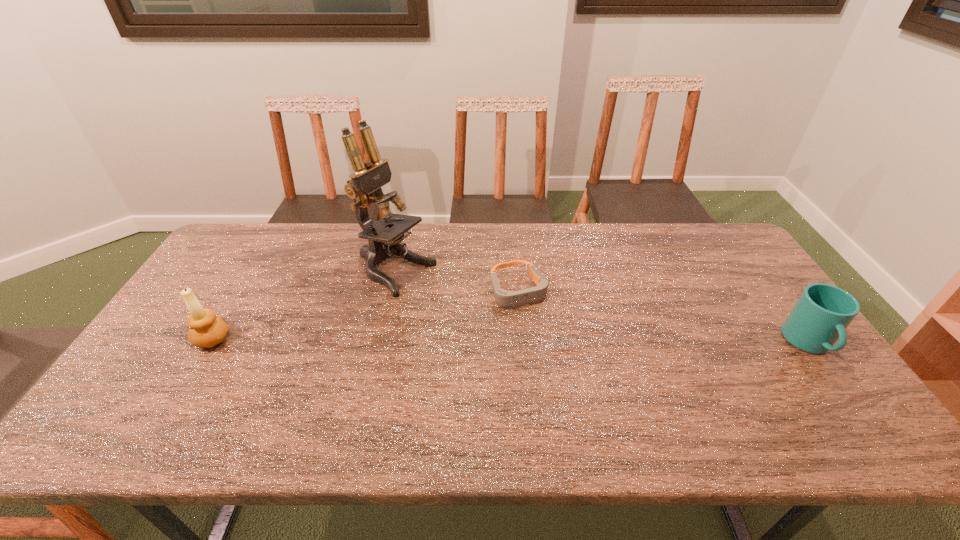
Locate an element on the screen. empty location between the microscope and the cup is located at coordinates (602, 308).

Identify the location of vacant area that lies between the leftmost object and the cup. The image size is (960, 540). (511, 341).

You are a GUI agent. You are given a task and a screenshot of the screen. Output one action in this format:
    pyautogui.click(x=<x>, y=<y>)
    Task: Click on the empty space between the second tallest object and the third object from left to right
    
    Given the screenshot: What is the action you would take?
    pyautogui.click(x=366, y=314)

You are a GUI agent. You are given a task and a screenshot of the screen. Output one action in this format:
    pyautogui.click(x=<x>, y=<y>)
    Task: Click on the object identified as the second closest to the second shortest object
    This screenshot has width=960, height=540.
    Given the screenshot: What is the action you would take?
    pyautogui.click(x=364, y=186)

Identify which object is located as the second nearest to the tallest object. Please provide its 2D coordinates. Your answer should be formatted as a tuple, i.e. [(x, y)], where the tuple contains the x and y coordinates of a point satisfying the conditions above.

[(206, 330)]

Identify the location of free location that satisfies the following two spatial constraints: 1. on the back side of the tallest object; 2. on the left side of the candle_holder. The image size is (960, 540). (252, 273).

Find the location of a particular element. The image size is (960, 540). free space that satisfies the following two spatial constraints: 1. on the back side of the candle_holder; 2. on the right side of the shortest object is located at coordinates (243, 289).